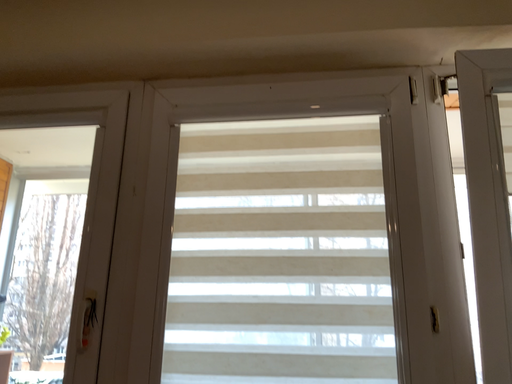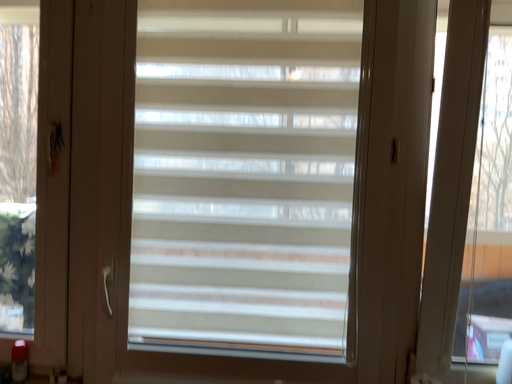
Question: How did the camera likely rotate when shooting the video?

Choices:
 (A) rotated downward
 (B) rotated upward

Answer: (A)